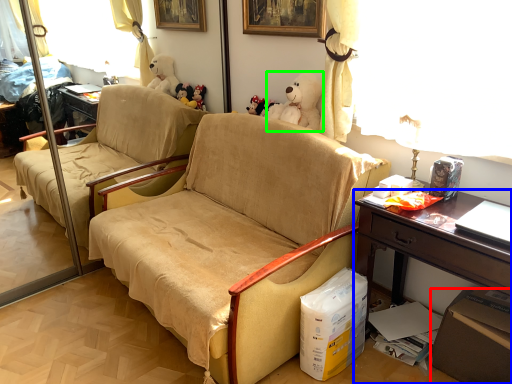
Question: Which is farther away from box (highlighted by a red box)? desk (highlighted by a blue box) or toy (highlighted by a green box)?

Choices:
 (A) desk
 (B) toy

Answer: (B)